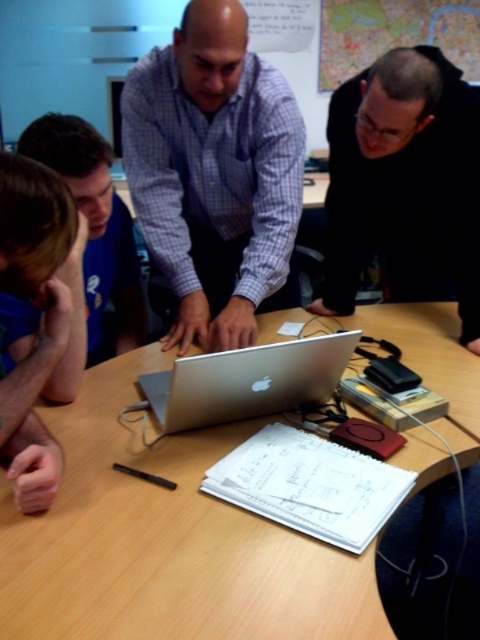
Question: Can you confirm if matte purple shirt at center is positioned below brown hair at left?

Choices:
 (A) no
 (B) yes

Answer: (A)

Question: Based on their relative distances, which object is nearer to the matte purple shirt at center?

Choices:
 (A) wooden table at center
 (B) brown hair at left

Answer: (A)

Question: Which of these objects is positioned closest to the wooden table at center?

Choices:
 (A) matte purple shirt at center
 (B) silver metallic laptop at center
 (C) brown hair at left

Answer: (B)

Question: Among these points, which one is farthest from the camera?

Choices:
 (A) (60, 179)
 (B) (157, 404)

Answer: (B)

Question: Can you confirm if blue shirt at left is thinner than silver metallic laptop at center?

Choices:
 (A) yes
 (B) no

Answer: (A)

Question: Can you confirm if brown hair at left is positioned to the right of silver metallic laptop at center?

Choices:
 (A) no
 (B) yes

Answer: (A)